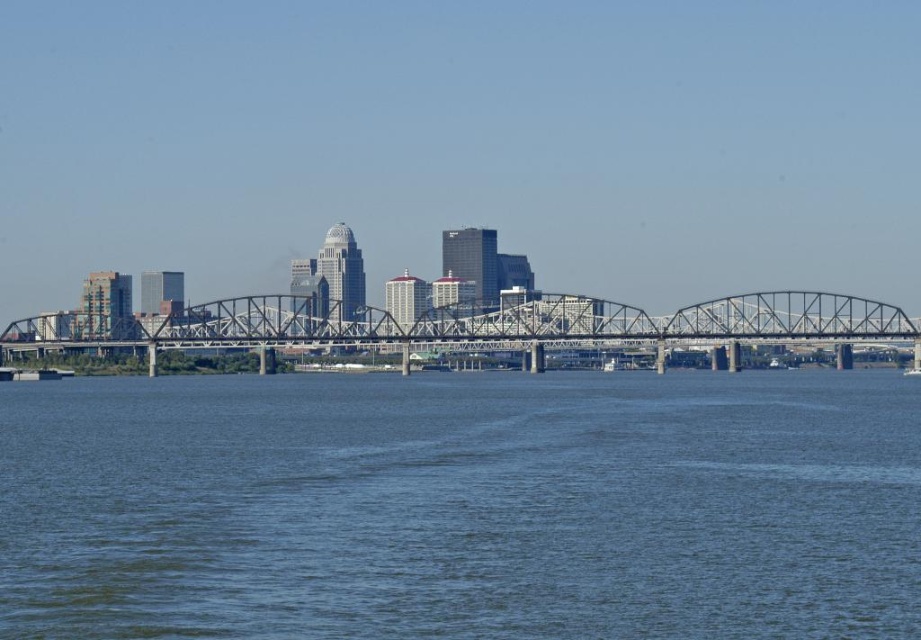
Can you confirm if blue water at center is shorter than metallic gray bridge at center?

In fact, blue water at center may be taller than metallic gray bridge at center.

Who is positioned more to the left, blue water at center or metallic gray bridge at center?

Positioned to the left is blue water at center.

Is point (759, 611) closer to camera compared to point (111, 340)?

Yes, point (759, 611) is in front of point (111, 340).

Find the location of `blue water at center`. blue water at center is located at coordinates (462, 506).